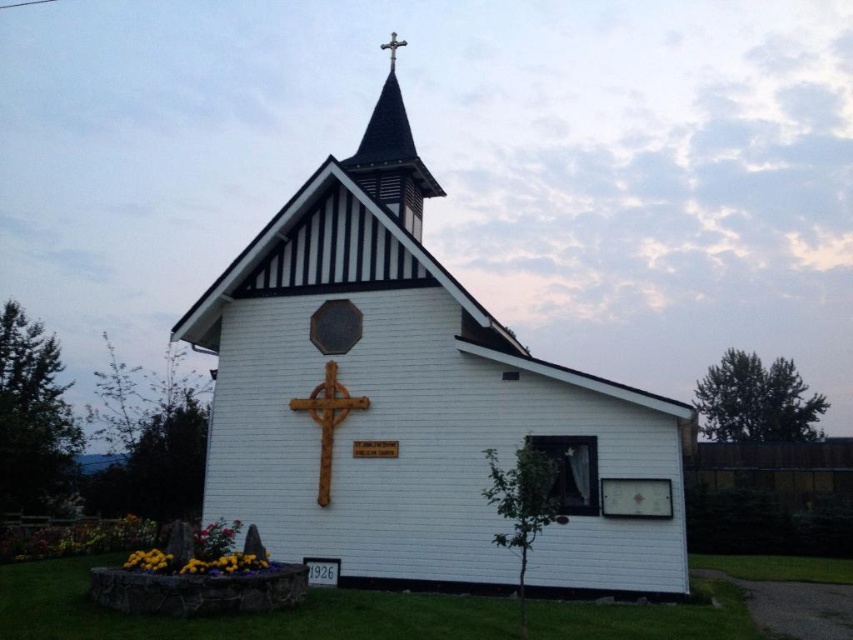
Who is more forward, (x=415, y=148) or (x=306, y=406)?

Point (x=306, y=406) is more forward.

Is black wood spire at upper center positioned behind rusty wood crucifix at center?

Yes, black wood spire at upper center is further from the viewer.

Locate an element on the screen. black wood spire at upper center is located at coordinates (392, 156).

At what (x,y) coordinates should I click in order to perform the action: click on black wood spire at upper center. Please return your answer as a coordinate pair (x, y). The image size is (853, 640). Looking at the image, I should click on (392, 156).

Which is below, white wooden chapel at center or wooden cross at upper center?

Positioned lower is white wooden chapel at center.

Is point (502, 438) closer to camera compared to point (387, 42)?

Yes, point (502, 438) is closer to viewer.

Between point (402, 310) and point (392, 38), which one is positioned in front?

Point (402, 310) is more forward.

At what (x,y) coordinates should I click in order to perform the action: click on white wooden chapel at center. Please return your answer as a coordinate pair (x, y). Image resolution: width=853 pixels, height=640 pixels. Looking at the image, I should click on (416, 403).

Is point (392, 77) behind point (393, 61)?

Yes, point (392, 77) is behind point (393, 61).

Does black wood spire at upper center have a greater height compared to wooden cross at upper center?

Yes.

Which is in front, point (392, 189) or point (392, 58)?

Point (392, 189) is in front.

Locate an element on the screen. This screenshot has height=640, width=853. black wood spire at upper center is located at coordinates (392, 156).